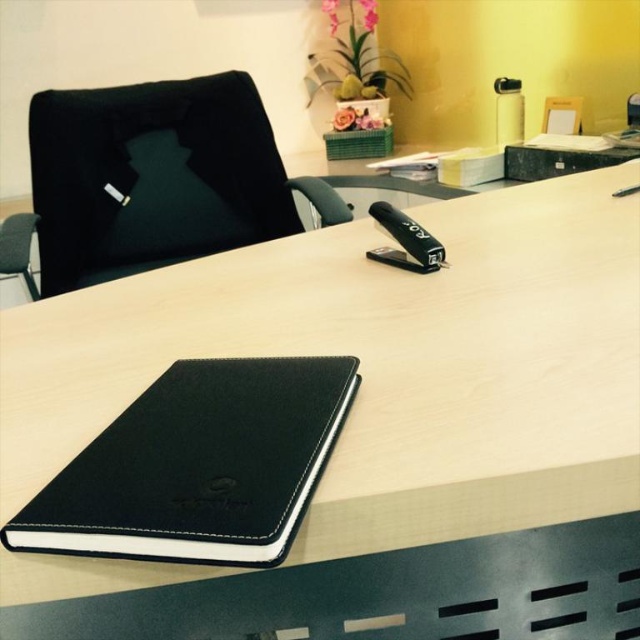
You are an office worker who needs to reach the black leather notebook at lower left and the black leather swivel chair at left. Which object is positioned lower in the image?

The black leather notebook at lower left is located below the black leather swivel chair at left, so it is positioned lower in the image.